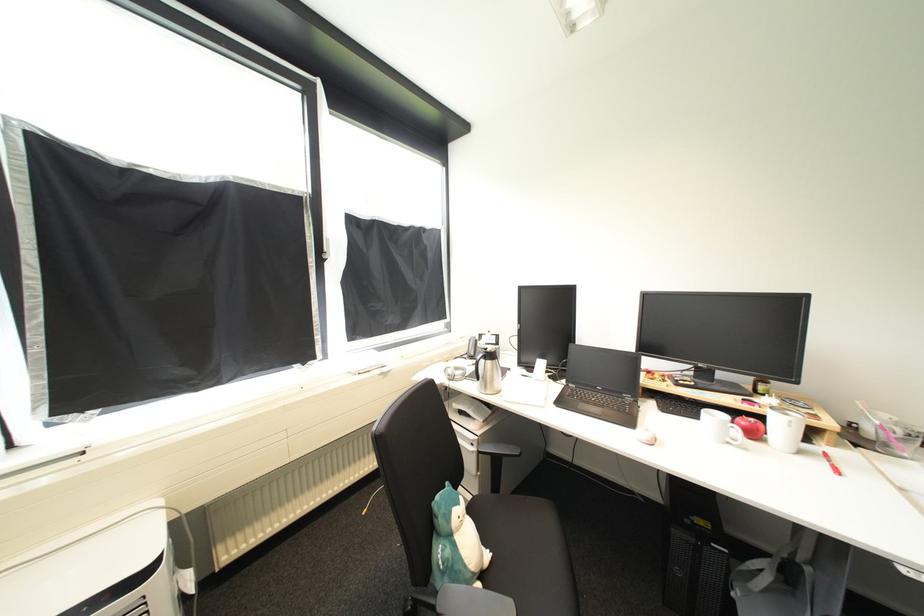
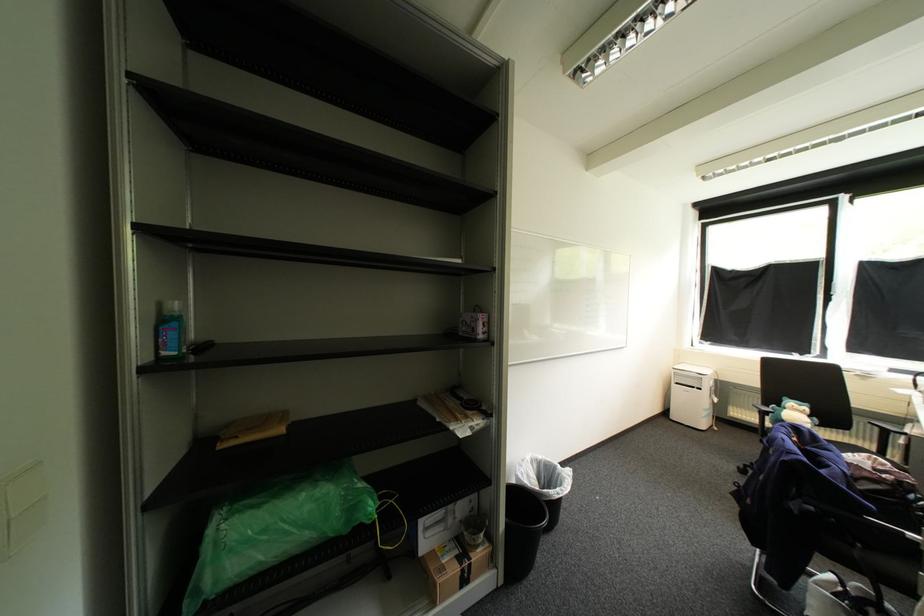
The point at (493, 557) is marked in the first image. Where is the corresponding point in the second image?

(813, 436)